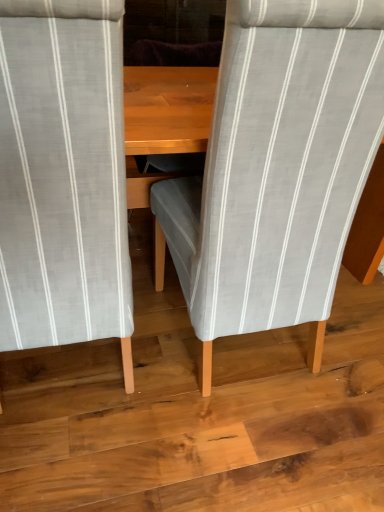
Locate an element on the screen. Image resolution: width=384 pixels, height=512 pixels. vacant space to the right of light gray striped fabric chair at center, the second chair when ordered from right to left is located at coordinates (173, 402).